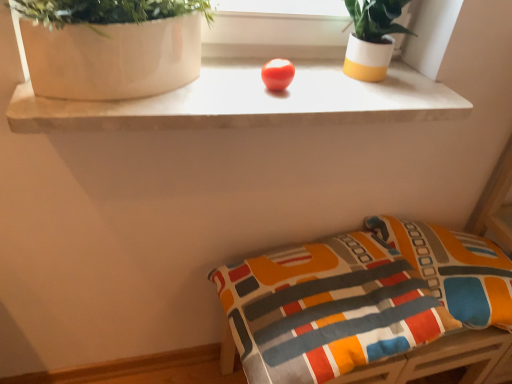
Locate an element on the screen. The image size is (512, 384). vacant space in front of white/yellow ceramic pot at upper right is located at coordinates (358, 96).